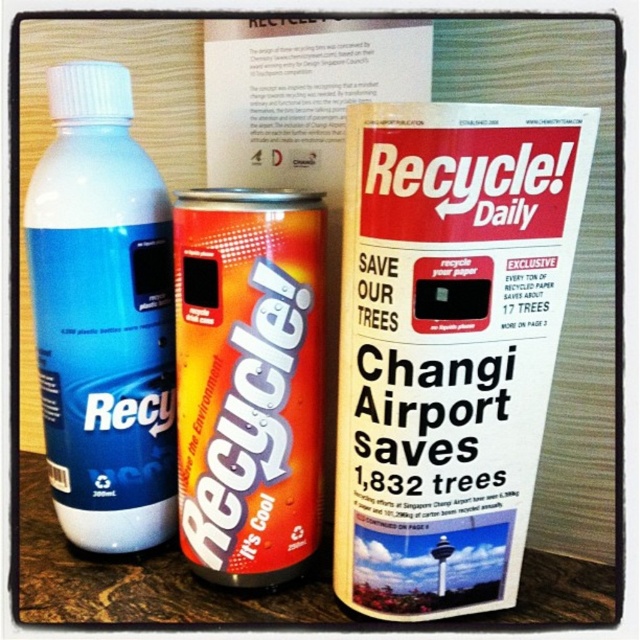
Looking at this image, who is positioned more to the left, recycled paper magazine at center or blue matte bottle at left?

From the viewer's perspective, blue matte bottle at left appears more on the left side.

Can you confirm if recycled paper magazine at center is positioned to the left of blue matte bottle at left?

In fact, recycled paper magazine at center is to the right of blue matte bottle at left.

Is point (356, 529) farther from camera compared to point (52, 109)?

No, (356, 529) is closer to viewer.

Identify the location of recycled paper magazine at center. (449, 344).

Is point (42, 216) behind point (241, 330)?

Yes.

Based on the photo, is blue matte bottle at left taller than orange metallic can at center?

Yes, blue matte bottle at left is taller than orange metallic can at center.

Is point (52, 435) positioned behind point (195, 435)?

Yes, it is.

The image size is (640, 640). Find the location of `blue matte bottle at left`. blue matte bottle at left is located at coordinates tap(102, 316).

Between recycled paper magazine at center and orange metallic can at center, which one has less height?

Standing shorter between the two is orange metallic can at center.

Can you confirm if recycled paper magazine at center is shorter than orange metallic can at center?

In fact, recycled paper magazine at center may be taller than orange metallic can at center.

Between point (440, 404) and point (237, 426), which one is positioned in front?

Point (440, 404) is in front.

I want to click on recycled paper magazine at center, so click(x=449, y=344).